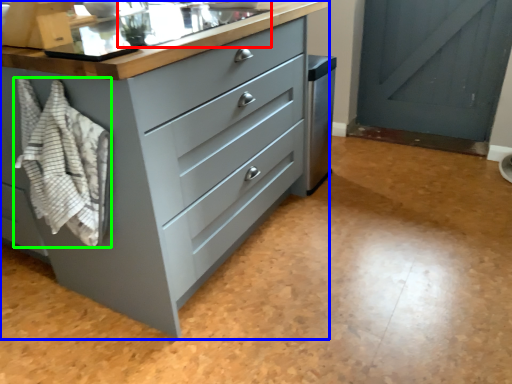
Question: Based on their relative distances, which object is nearer to sink (highlighted by a red box)? Choose from chest of drawers (highlighted by a blue box) and blanket (highlighted by a green box).

Choices:
 (A) chest of drawers
 (B) blanket

Answer: (A)